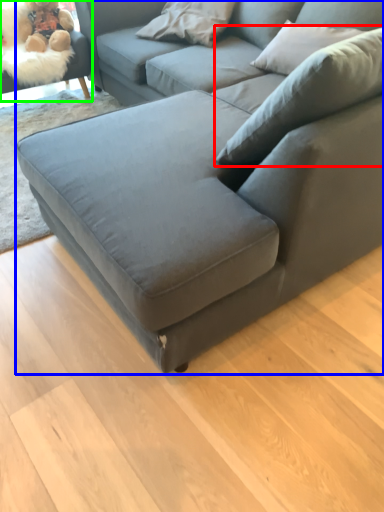
Question: Which is farther away from pillow (highlighted by a red box)? studio couch (highlighted by a blue box) or swivel chair (highlighted by a green box)?

Choices:
 (A) studio couch
 (B) swivel chair

Answer: (B)